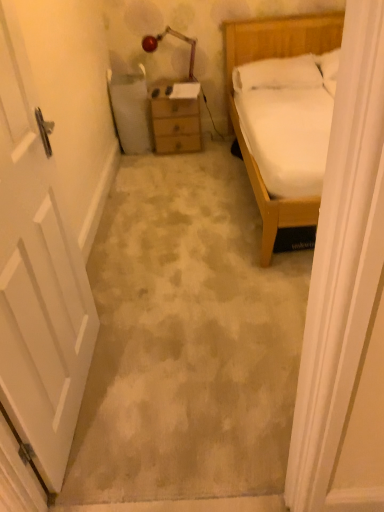
Question: Based on their positions, is metallic red lamp at upper center located to the left or right of white matte door at left?

Choices:
 (A) right
 (B) left

Answer: (A)

Question: From their relative heights in the image, would you say metallic red lamp at upper center is taller or shorter than white matte door at left?

Choices:
 (A) tall
 (B) short

Answer: (B)

Question: Which of these objects is positioned closest to the metallic red lamp at upper center?

Choices:
 (A) wooden chest of drawers at center
 (B) white matte door at left
 (C) white matte door at left
 (D) white soft pillow at upper right

Answer: (A)

Question: Estimate the real-world distances between objects in this image. Which object is farther from the wooden chest of drawers at center?

Choices:
 (A) white soft pillow at upper right
 (B) white matte door at left
 (C) metallic red lamp at upper center
 (D) white matte door at left

Answer: (D)